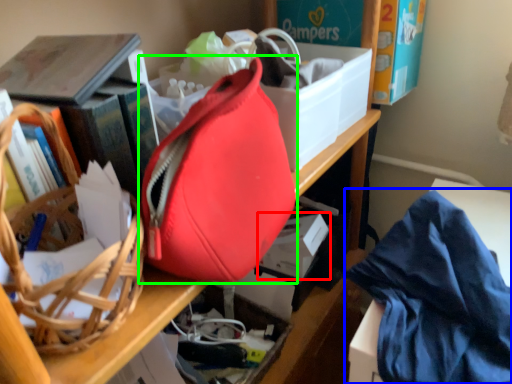
Question: Estimate the real-world distances between objects in this image. Which object is farther from storage box (highlighted by a red box), clothe (highlighted by a blue box) or handbag (highlighted by a green box)?

Choices:
 (A) clothe
 (B) handbag

Answer: (B)